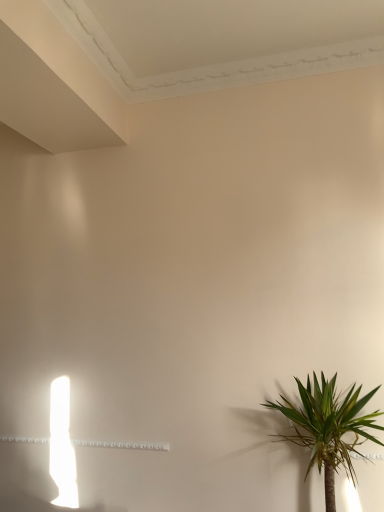
Measure the distance between point (348, 468) and camera.

Point (348, 468) is 8.42 feet away from camera.

Looking at this image, what is the approximate height of green leafy plant at lower right?

33.84 inches.

The height and width of the screenshot is (512, 384). In order to click on green leafy plant at lower right in this screenshot , I will do `click(328, 428)`.

This screenshot has height=512, width=384. What do you see at coordinates (328, 428) in the screenshot?
I see `green leafy plant at lower right` at bounding box center [328, 428].

Find the location of `green leafy plant at lower right`. green leafy plant at lower right is located at coordinates (328, 428).